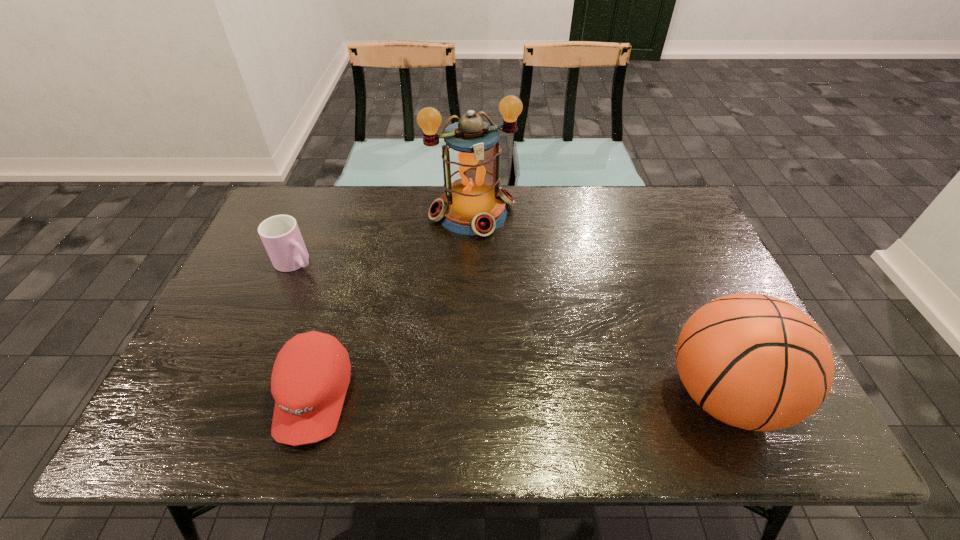
You are a GUI agent. You are given a task and a screenshot of the screen. Output one action in this format:
    pyautogui.click(x=<x>, y=<y>)
    Task: Click on the cap
    
    Given the screenshot: What is the action you would take?
    pyautogui.click(x=311, y=374)

What are the coordinates of `the rightmost object` in the screenshot? It's located at (753, 361).

Locate an element on the screen. This screenshot has width=960, height=540. basketball is located at coordinates (753, 361).

Image resolution: width=960 pixels, height=540 pixels. Identify the location of lantern. (473, 203).

This screenshot has width=960, height=540. Identify the location of the farthest object. (473, 203).

This screenshot has height=540, width=960. In order to click on the leftmost object in this screenshot , I will do click(x=280, y=234).

You are a GUI agent. You are given a task and a screenshot of the screen. Output one action in this format:
    pyautogui.click(x=<x>, y=<y>)
    Task: Click on the third nearest object
    The width and height of the screenshot is (960, 540).
    Given the screenshot: What is the action you would take?
    pyautogui.click(x=280, y=234)

Image resolution: width=960 pixels, height=540 pixels. I want to click on free location located 0.350m on the left of the second tallest object, so click(x=504, y=395).

Where is `vacant point located 0.150m on the front-facing side of the farthest object`? This screenshot has width=960, height=540. vacant point located 0.150m on the front-facing side of the farthest object is located at coordinates (503, 273).

Identify the location of vacant area situated 0.290m on the front-facing side of the farthest object. The height and width of the screenshot is (540, 960). (521, 309).